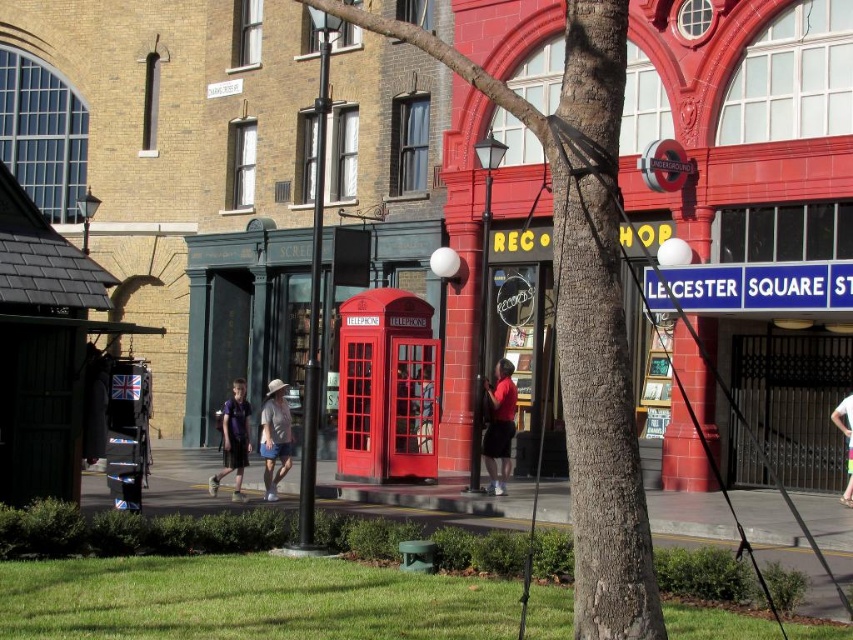
Question: Can you confirm if smooth bark tree at center is positioned below red matte shirt at center?

Choices:
 (A) no
 (B) yes

Answer: (A)

Question: In this image, where is red matte shirt at center located relative to dark blue jersey at center?

Choices:
 (A) below
 (B) above

Answer: (B)

Question: Among these points, which one is farthest from the camera?

Choices:
 (A) [511, 426]
 (B) [428, 342]
 (C) [245, 456]

Answer: (B)

Question: Does red matte shirt at center appear under white fabric pants at lower right?

Choices:
 (A) yes
 (B) no

Answer: (B)

Question: Which object is the closest to the red matte shirt at center?

Choices:
 (A) denim shorts at center
 (B) smooth bark tree at center
 (C) dark blue jersey at center
 (D) glossy red telephone box at center

Answer: (D)

Question: Which point appears closest to the camera in this image?

Choices:
 (A) (503, 468)
 (B) (843, 493)
 (C) (389, 452)
 (D) (279, 456)

Answer: (D)